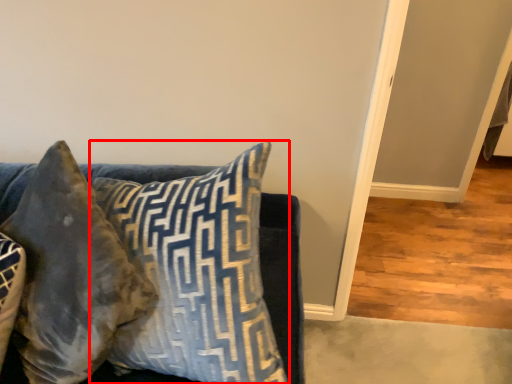
Question: In this image, where is pillow (annotated by the red box) located relative to pillow?

Choices:
 (A) left
 (B) right

Answer: (B)